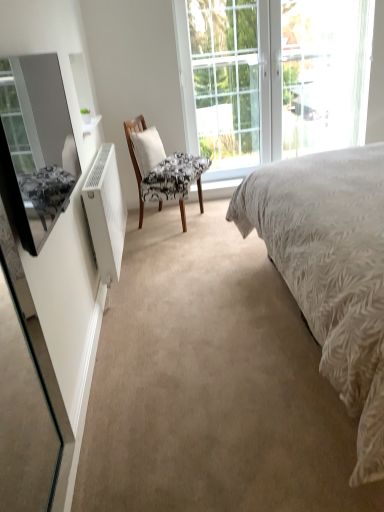
In order to click on unoccupied area in front of white matte radiator at left in this screenshot , I will do `click(141, 308)`.